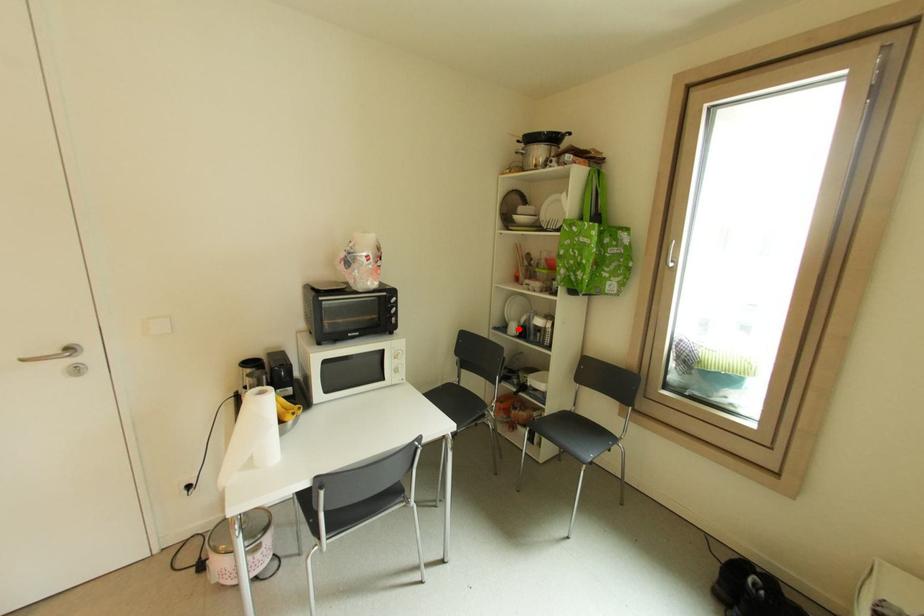
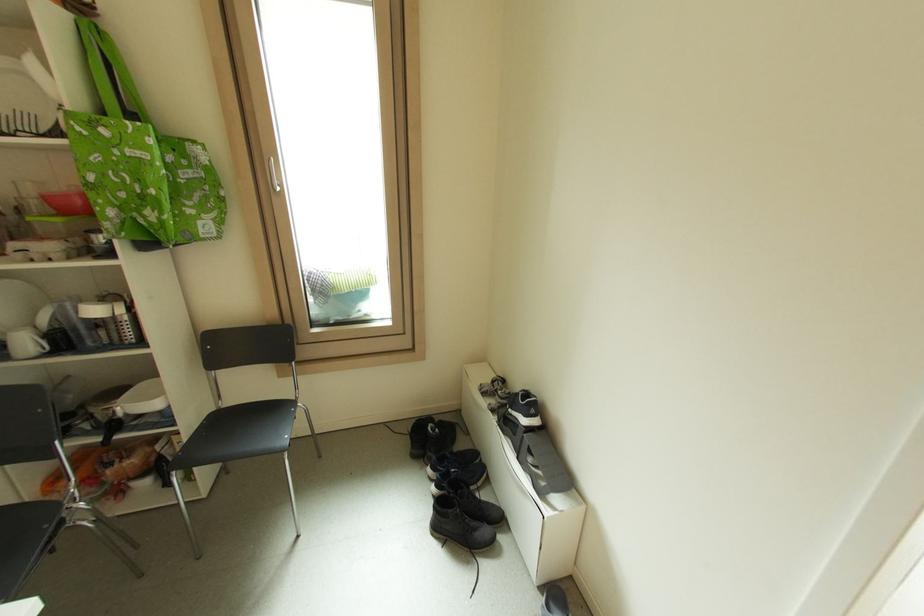
Locate, in the second image, the point that corresponds to the highlighted location in the first image.

(31, 344)